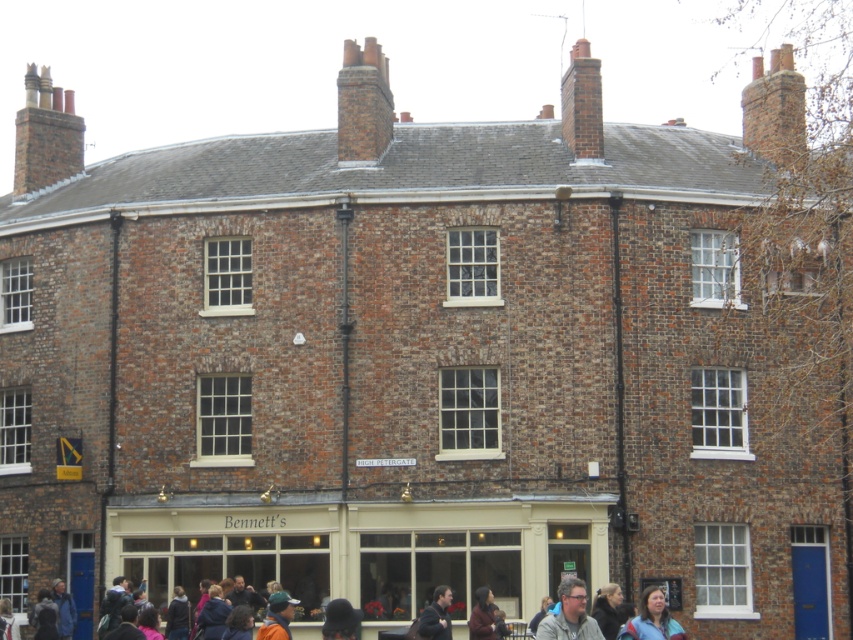
Does dark blue jacket at lower center have a greater width compared to blue fabric jacket at lower right?

Correct, the width of dark blue jacket at lower center exceeds that of blue fabric jacket at lower right.

The height and width of the screenshot is (640, 853). Find the location of `dark blue jacket at lower center`. dark blue jacket at lower center is located at coordinates (637, 616).

The width and height of the screenshot is (853, 640). I want to click on dark blue jacket at lower center, so click(x=637, y=616).

Between matte gray glasses at lower center and dark brown leather jacket at lower center, which one appears on the left side from the viewer's perspective?

From the viewer's perspective, dark brown leather jacket at lower center appears more on the left side.

Measure the distance between point (579, 628) and camera.

Point (579, 628) is 44.60 meters away from camera.

Who is more forward, (582, 593) or (437, 620)?

Point (582, 593) is more forward.

Locate an element on the screen. The width and height of the screenshot is (853, 640). matte gray glasses at lower center is located at coordinates [x=569, y=614].

Does blue fabric jacket at lower right appear on the right side of dark brown leather jacket at lower center?

Indeed, blue fabric jacket at lower right is positioned on the right side of dark brown leather jacket at lower center.

Image resolution: width=853 pixels, height=640 pixels. What do you see at coordinates (651, 620) in the screenshot? I see `blue fabric jacket at lower right` at bounding box center [651, 620].

Find the location of `blue fabric jacket at lower right`. blue fabric jacket at lower right is located at coordinates (651, 620).